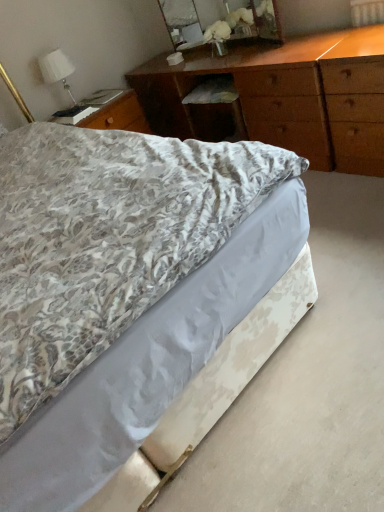
Identify the location of floral-patterned fabric bed at center. The width and height of the screenshot is (384, 512). (122, 288).

What do you see at coordinates (122, 288) in the screenshot?
I see `floral-patterned fabric bed at center` at bounding box center [122, 288].

Measure the distance between white fabric lampshade at upper left and camera.

8.75 feet.

At what (x,y) coordinates should I click in order to perform the action: click on wooden chest of drawers at upper center. Please return your answer as a coordinate pair (x, y). Image resolution: width=384 pixels, height=512 pixels. Looking at the image, I should click on (285, 96).

The height and width of the screenshot is (512, 384). Identify the location of floral-patterned fabric bed at center. (122, 288).

From a real-world perspective, which object rests below the other?

wooden chest of drawers at upper center.

Can you confirm if wooden chest of drawers at upper center is thinner than wooden mirror at upper center?

No, wooden chest of drawers at upper center is not thinner than wooden mirror at upper center.

From the image's perspective, which is below, wooden chest of drawers at upper center or wooden mirror at upper center?

wooden chest of drawers at upper center is shown below in the image.

Which of these two, wooden chest of drawers at upper center or wooden mirror at upper center, is smaller?

wooden mirror at upper center is smaller.

In terms of height, does floral-patterned fabric bed at center look taller or shorter compared to wooden chest of drawers at upper center?

Clearly, floral-patterned fabric bed at center is shorter compared to wooden chest of drawers at upper center.

From a real-world perspective, which object rests below the other?

From a 3D spatial view, floral-patterned fabric bed at center is below.

Considering the sizes of objects floral-patterned fabric bed at center and wooden chest of drawers at upper center in the image provided, who is wider, floral-patterned fabric bed at center or wooden chest of drawers at upper center?

floral-patterned fabric bed at center.

Is floral-patterned fabric bed at center bigger or smaller than wooden chest of drawers at upper center?

Clearly, floral-patterned fabric bed at center is smaller in size than wooden chest of drawers at upper center.

From the image's perspective, is wooden chest of drawers at upper center located above or below white fabric lampshade at upper left?

wooden chest of drawers at upper center is below white fabric lampshade at upper left.

From their relative heights in the image, would you say wooden chest of drawers at upper center is taller or shorter than white fabric lampshade at upper left?

Clearly, wooden chest of drawers at upper center is taller compared to white fabric lampshade at upper left.

Which point is more forward, [167,90] or [43,59]?

The point [43,59] is closer to the camera.

Is the position of wooden chest of drawers at upper center more distant than that of white fabric lampshade at upper left?

No.

From the image's perspective, who appears lower, floral-patterned fabric bed at center or wooden mirror at upper center?

floral-patterned fabric bed at center, from the image's perspective.

Does point (163, 360) come in front of point (173, 35)?

Yes, it is in front of point (173, 35).

Considering the sizes of floral-patterned fabric bed at center and wooden mirror at upper center in the image, is floral-patterned fabric bed at center wider or thinner than wooden mirror at upper center?

Considering their sizes, floral-patterned fabric bed at center looks broader than wooden mirror at upper center.

Is floral-patterned fabric bed at center aimed at wooden mirror at upper center?

No, floral-patterned fabric bed at center is not turned towards wooden mirror at upper center.

The height and width of the screenshot is (512, 384). Identify the location of mirror above the white fabric lampshade at upper left (from the image's perspective). (219, 20).

How many degrees apart are the facing directions of white fabric lampshade at upper left and wooden mirror at upper center?

90.1 degrees.

From the image's perspective, between white fabric lampshade at upper left and wooden mirror at upper center, who is located below?

white fabric lampshade at upper left appears lower in the image.

Looking at the image, does white fabric lampshade at upper left seem bigger or smaller compared to wooden mirror at upper center?

white fabric lampshade at upper left is smaller than wooden mirror at upper center.

Would you say floral-patterned fabric bed at center contains white fabric lampshade at upper left?

No, white fabric lampshade at upper left is not inside floral-patterned fabric bed at center.

Does floral-patterned fabric bed at center come in front of white fabric lampshade at upper left?

Yes, it is in front of white fabric lampshade at upper left.

Between floral-patterned fabric bed at center and white fabric lampshade at upper left, which one has smaller size?

white fabric lampshade at upper left.

From the image's perspective, which object appears higher, floral-patterned fabric bed at center or white fabric lampshade at upper left?

white fabric lampshade at upper left, from the image's perspective.

Is wooden mirror at upper center smaller than wooden chest of drawers at upper center?

Indeed, wooden mirror at upper center has a smaller size compared to wooden chest of drawers at upper center.

At what (x,y) coordinates should I click in order to perform the action: click on mirror on the left of wooden chest of drawers at upper center. Please return your answer as a coordinate pair (x, y). Looking at the image, I should click on (219, 20).

Are wooden mirror at upper center and wooden chest of drawers at upper center far apart?

No, wooden mirror at upper center is not far from wooden chest of drawers at upper center.

Which of these two, wooden mirror at upper center or wooden chest of drawers at upper center, stands taller?

wooden chest of drawers at upper center.

What are the coordinates of `mirror that appears on the left of wooden chest of drawers at upper center` in the screenshot? It's located at (219, 20).

The height and width of the screenshot is (512, 384). In order to click on chest of drawers behind the floral-patterned fabric bed at center in this screenshot , I will do `click(285, 96)`.

Based on their spatial positions, is floral-patterned fabric bed at center or wooden chest of drawers at upper center further from white fabric lampshade at upper left?

Among the two, floral-patterned fabric bed at center is located further to white fabric lampshade at upper left.

Based on the photo, when comparing their distances from floral-patterned fabric bed at center, does white fabric lampshade at upper left or wooden chest of drawers at upper center seem further?

white fabric lampshade at upper left lies further to floral-patterned fabric bed at center than the other object.

Estimate the real-world distances between objects in this image. Which object is further from white fabric lampshade at upper left, wooden mirror at upper center or wooden chest of drawers at upper center?

Based on the image, wooden chest of drawers at upper center appears to be further to white fabric lampshade at upper left.

Considering their positions, is wooden mirror at upper center positioned closer to wooden chest of drawers at upper center than floral-patterned fabric bed at center?

wooden mirror at upper center is closer to wooden chest of drawers at upper center.

From the image, which object appears to be farther from wooden mirror at upper center, wooden chest of drawers at upper center or white fabric lampshade at upper left?

white fabric lampshade at upper left is positioned further to the anchor wooden mirror at upper center.

From the image, which object appears to be nearer to wooden chest of drawers at upper center, floral-patterned fabric bed at center or white fabric lampshade at upper left?

white fabric lampshade at upper left is positioned closer to the anchor wooden chest of drawers at upper center.

Based on their spatial positions, is white fabric lampshade at upper left or wooden mirror at upper center further from floral-patterned fabric bed at center?

wooden mirror at upper center.

From the image, which object appears to be nearer to wooden chest of drawers at upper center, floral-patterned fabric bed at center or wooden mirror at upper center?

wooden mirror at upper center lies closer to wooden chest of drawers at upper center than the other object.

You are a GUI agent. You are given a task and a screenshot of the screen. Output one action in this format:
    pyautogui.click(x=<x>, y=<y>)
    Task: Click on the chest of drawers between floral-patterned fabric bed at center and white fabric lampshade at upper left from front to back
    The image size is (384, 512).
    Given the screenshot: What is the action you would take?
    pyautogui.click(x=285, y=96)

Image resolution: width=384 pixels, height=512 pixels. Find the location of `chest of drawers between wooden mirror at upper center and floral-patterned fabric bed at center from top to bottom`. chest of drawers between wooden mirror at upper center and floral-patterned fabric bed at center from top to bottom is located at coordinates (285, 96).

Identify the location of mirror positioned between floral-patterned fabric bed at center and white fabric lampshade at upper left from near to far. (219, 20).

This screenshot has width=384, height=512. Identify the location of mirror located between white fabric lampshade at upper left and wooden chest of drawers at upper center in the left-right direction. (219, 20).